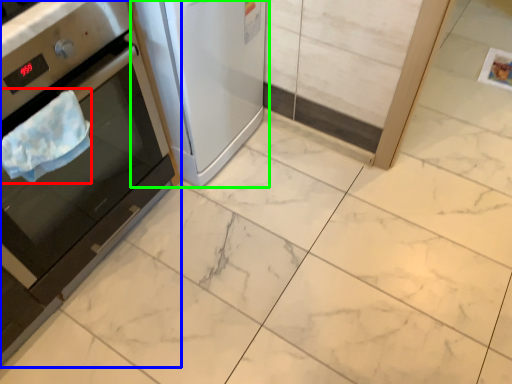
Question: Considering the real-world distances, which object is closest to blanket (highlighted by a red box)? home appliance (highlighted by a blue box) or home appliance (highlighted by a green box).

Choices:
 (A) home appliance
 (B) home appliance

Answer: (A)